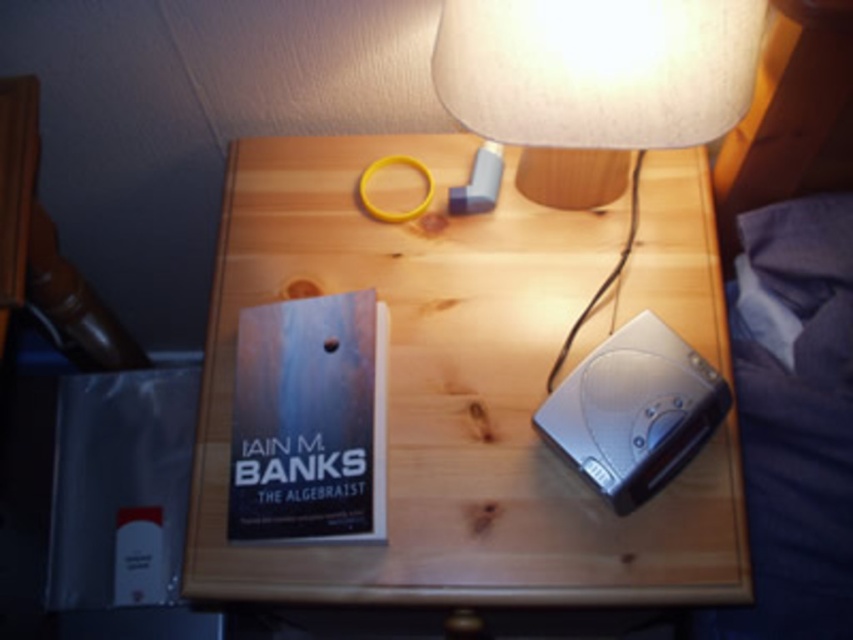
You are trying to reach the matte beige lampshade at upper center from the wooden table at center. Which direction should you move to get closer to it?

The matte beige lampshade at upper center is behind the wooden table at center, so to reach it, you would need to move backward away from the table.

You have a small decorative item that is 10 cm wide. You want to place it on the wooden table at center without overlapping the hardcover book at center. Is there enough space on the table for this?

The wooden table at center is wider than the hardcover book at center, so there should be enough space to place the 10 cm wide decorative item without overlapping the book.

You have a small decorative item that is 3 inches wide. You want to place it between the matte beige lampshade at upper center and the hardcover book at center on the table. Is there enough space for it?

The matte beige lampshade at upper center and hardcover book at center are 12.05 inches apart from each other, so yes, there is enough space to place a 3 inch wide decorative item between them.